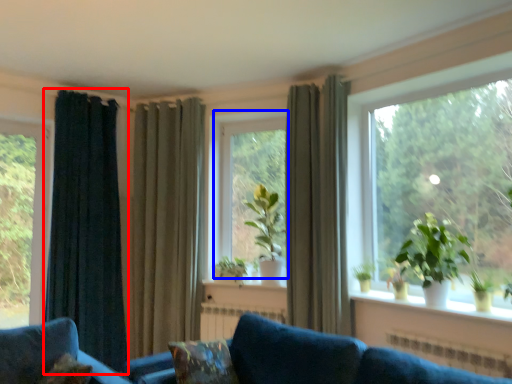
Question: Which point is further to the camera, curtain (highlighted by a red box) or bay window (highlighted by a blue box)?

Choices:
 (A) curtain
 (B) bay window

Answer: (B)